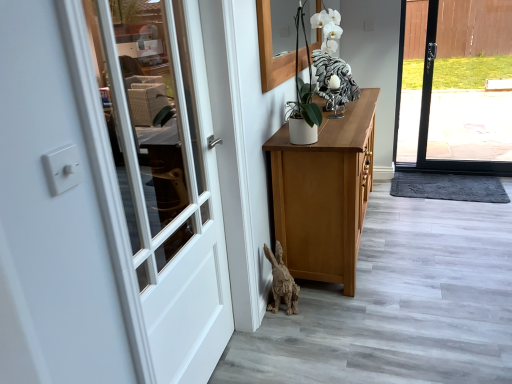
Question: Can white wood door at left be found inside wooden frame at upper center?

Choices:
 (A) yes
 (B) no

Answer: (B)

Question: Does wooden frame at upper center have a greater width compared to white wood door at left?

Choices:
 (A) yes
 (B) no

Answer: (B)

Question: Is wooden frame at upper center in contact with white wood door at left?

Choices:
 (A) yes
 (B) no

Answer: (B)

Question: Considering the relative positions of wooden frame at upper center and white wood door at left in the image provided, is wooden frame at upper center to the right of white wood door at left from the viewer's perspective?

Choices:
 (A) no
 (B) yes

Answer: (B)

Question: From a real-world perspective, is wooden frame at upper center positioned over white wood door at left based on gravity?

Choices:
 (A) yes
 (B) no

Answer: (A)

Question: Is wooden frame at upper center oriented towards white wood door at left?

Choices:
 (A) no
 (B) yes

Answer: (A)

Question: Can you confirm if wooden rabbit at lower center, arranged as the first animal when viewed from the front, is shorter than white wood door at left?

Choices:
 (A) no
 (B) yes

Answer: (B)

Question: Does wooden rabbit at lower center, which is the second animal in top-to-bottom order, appear on the left side of white wood door at left?

Choices:
 (A) no
 (B) yes

Answer: (A)

Question: Can white wood door at left be found inside wooden rabbit at lower center, the 1th animal positioned from the bottom?

Choices:
 (A) yes
 (B) no

Answer: (B)

Question: Is wooden rabbit at lower center, the 1th animal viewed from the left, directly adjacent to white wood door at left?

Choices:
 (A) no
 (B) yes

Answer: (A)

Question: Considering the relative sizes of wooden rabbit at lower center, the second animal viewed from the right, and white wood door at left in the image provided, is wooden rabbit at lower center, the second animal viewed from the right, thinner than white wood door at left?

Choices:
 (A) yes
 (B) no

Answer: (B)

Question: Does wooden rabbit at lower center, the second animal from the back, appear on the right side of white wood door at left?

Choices:
 (A) yes
 (B) no

Answer: (A)

Question: Is white glossy rooster at upper center, which appears as the first animal when viewed from the right, bigger than white wood door at left?

Choices:
 (A) no
 (B) yes

Answer: (A)